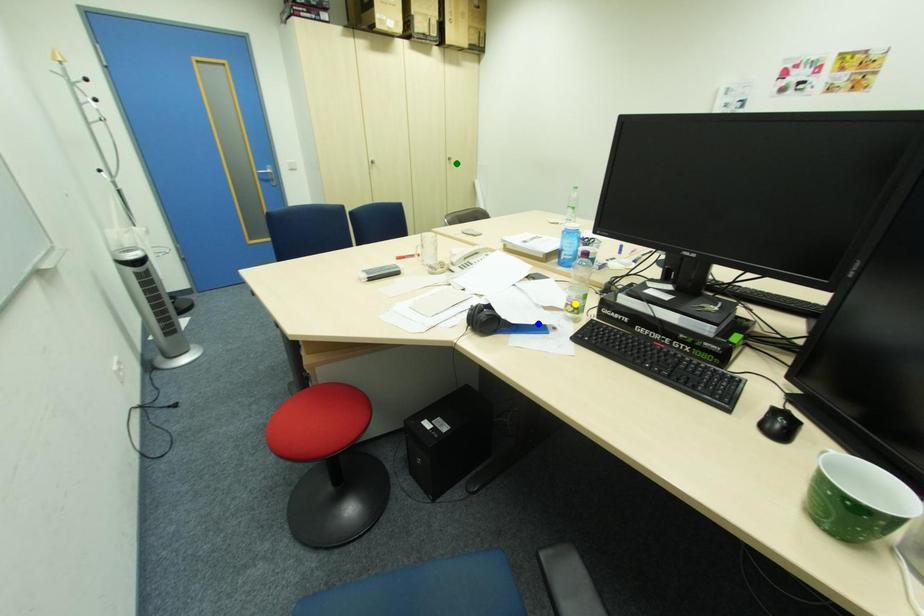
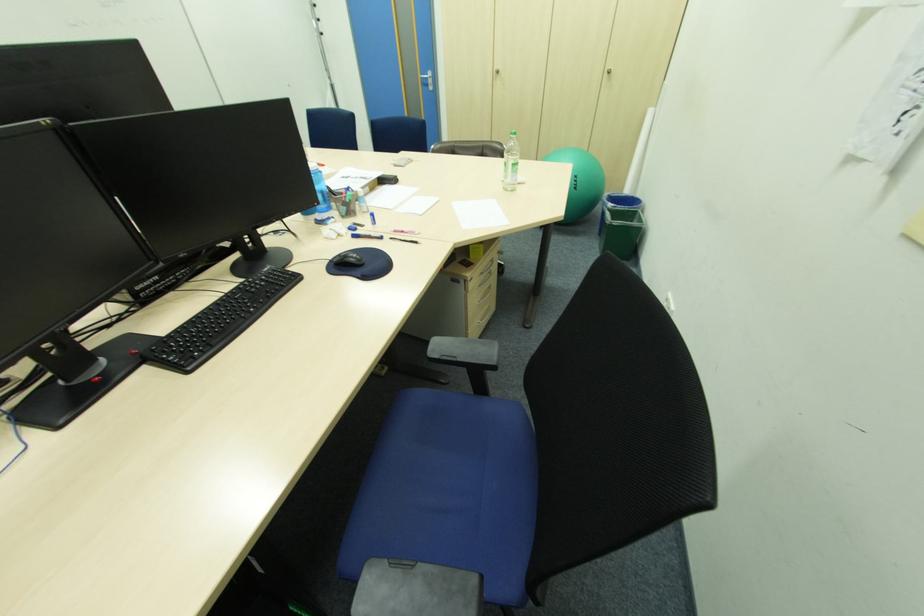
I am providing you with two images of the same scene from different viewpoints. Three points are marked in image1. Which point corresponds to a part or object that is occluded in image2?In image1, three points are marked. Which of them correspond to a part or object that is occluded in image2?Among the three points shown in image1, which one corresponds to a part or object that is no longer visible due to occlusion in image2?

Invisible in image2: yellow point, blue point.